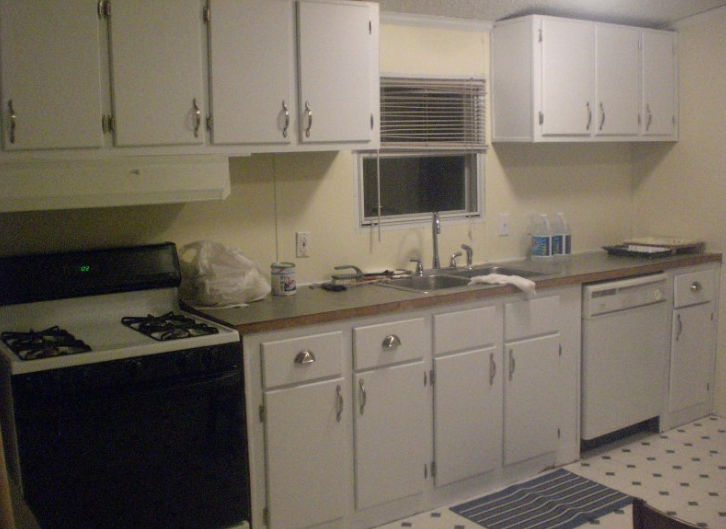
Where is `blinds`? blinds is located at coordinates (441, 121).